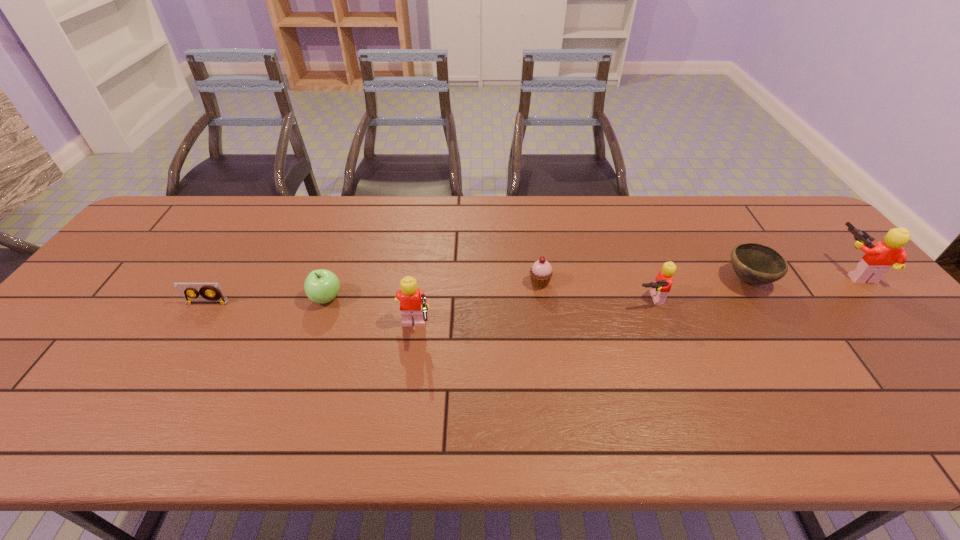
Image resolution: width=960 pixels, height=540 pixels. What are the coordinates of `empty space that is in between the nearest object and the apple` in the screenshot? It's located at (371, 314).

Locate an element on the screen. The image size is (960, 540). vacant area that lies between the videotape and the rightmost object is located at coordinates (531, 287).

You are a GUI agent. You are given a task and a screenshot of the screen. Output one action in this format:
    pyautogui.click(x=<x>, y=<y>)
    Task: Click on the free space between the shortest Lego and the apple
    
    Given the screenshot: What is the action you would take?
    pyautogui.click(x=488, y=299)

Find the location of a particular element. This screenshot has width=960, height=540. vacant space that's between the second Lego from right to left and the cupcake is located at coordinates (594, 291).

The width and height of the screenshot is (960, 540). Identify the location of vacant area that lies between the bowl and the nearest Lego. (581, 305).

Identify which object is the second nearest to the leftmost Lego. Please provide its 2D coordinates. Your answer should be formatted as a tuple, i.e. [(x, y)], where the tuple contains the x and y coordinates of a point satisfying the conditions above.

[(541, 272)]

This screenshot has height=540, width=960. I want to click on object that stands as the second closest to the third object from left to right, so click(x=541, y=272).

Where is `the second closest Lego to the sixth shortest object`? The image size is (960, 540). the second closest Lego to the sixth shortest object is located at coordinates (878, 259).

Select which Lego appears as the third closest to the fourth object from left to right. Please provide its 2D coordinates. Your answer should be formatted as a tuple, i.e. [(x, y)], where the tuple contains the x and y coordinates of a point satisfying the conditions above.

[(878, 259)]

The height and width of the screenshot is (540, 960). I want to click on blank space that satisfies the following two spatial constraints: 1. in front of the second nearest Lego with the accessory visible; 2. in front of the nearest Lego with the accessory visible, so click(660, 330).